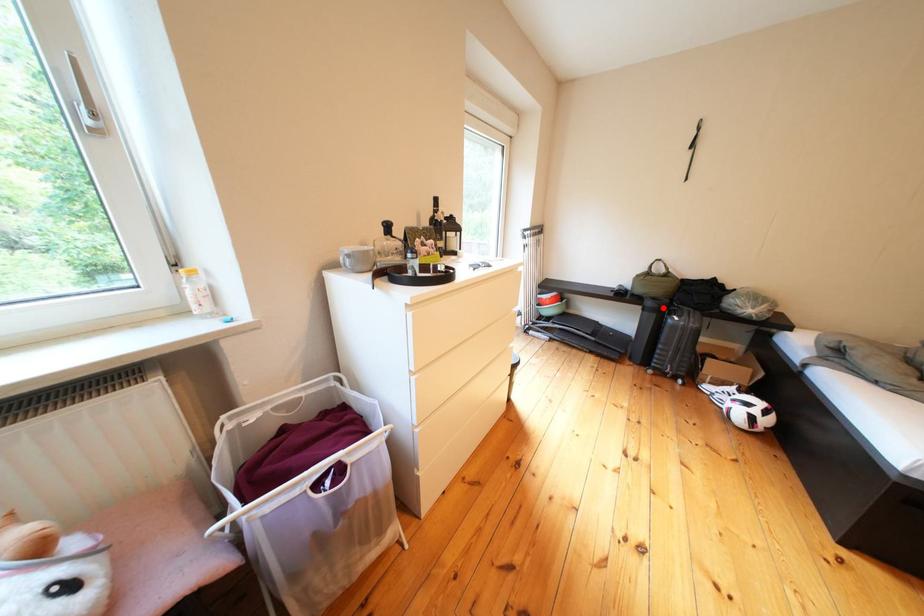
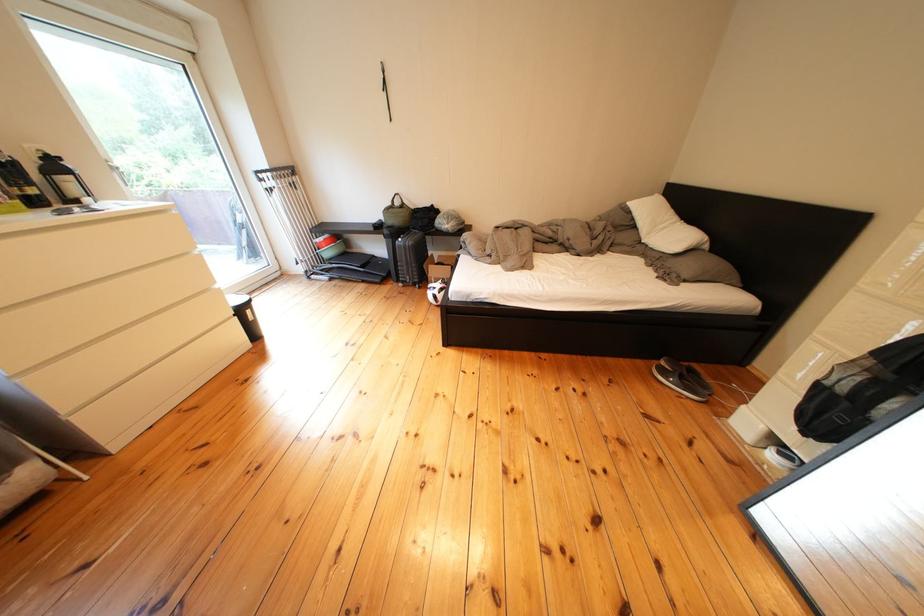
The point at the highlighted location is marked in the first image. Where is the corresponding point in the second image?

(399, 236)